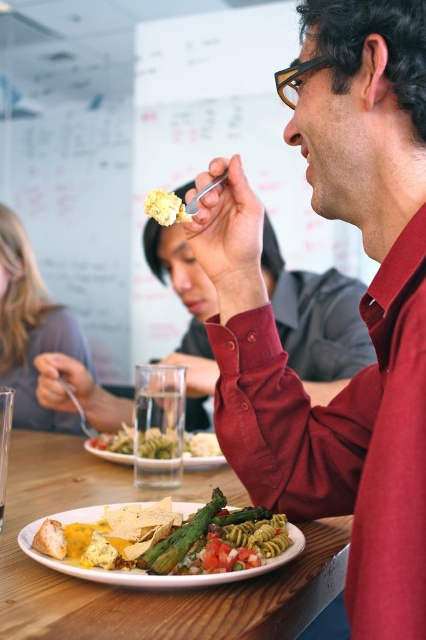
Question: Does green matte asparagus at center appear on the left side of yellow crumbly at upper center?

Choices:
 (A) no
 (B) yes

Answer: (A)

Question: Is matte gray sweater at upper left thinner than green matte asparagus at center?

Choices:
 (A) yes
 (B) no

Answer: (B)

Question: Which is farther from the matte yellow plate with pasta and vegetables at center?

Choices:
 (A) matte red shirt at upper right
 (B) white wooden table at center

Answer: (A)

Question: Which point is closer to the camera taking this photo?

Choices:
 (A) (129, 448)
 (B) (167, 211)
 (C) (0, 246)
 (D) (204, 516)

Answer: (D)

Question: Does matte red shirt at upper right have a lesser width compared to white wooden table at center?

Choices:
 (A) yes
 (B) no

Answer: (A)

Question: Which is nearer to the green asparagus at center?

Choices:
 (A) matte yellow plate with pasta and vegetables at center
 (B) green matte asparagus at center
 (C) matte red shirt at upper right

Answer: (A)